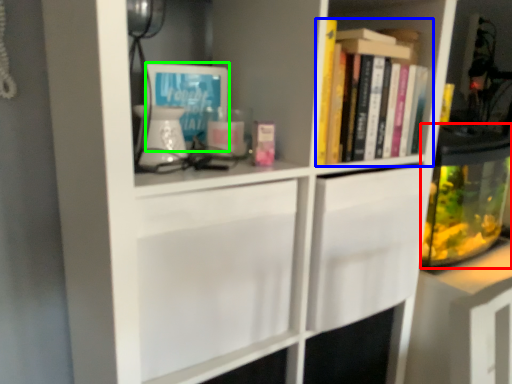
Question: Which object is the farthest from glass jar (highlighted by a red box)? Choose among these: book (highlighted by a blue box) or book cover (highlighted by a green box).

Choices:
 (A) book
 (B) book cover

Answer: (B)